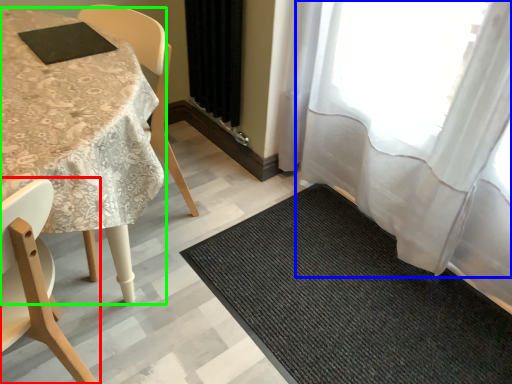
Question: Considering the real-world distances, which object is farthest from chair (highlighted by a red box)? curtain (highlighted by a blue box) or table (highlighted by a green box)?

Choices:
 (A) curtain
 (B) table

Answer: (A)